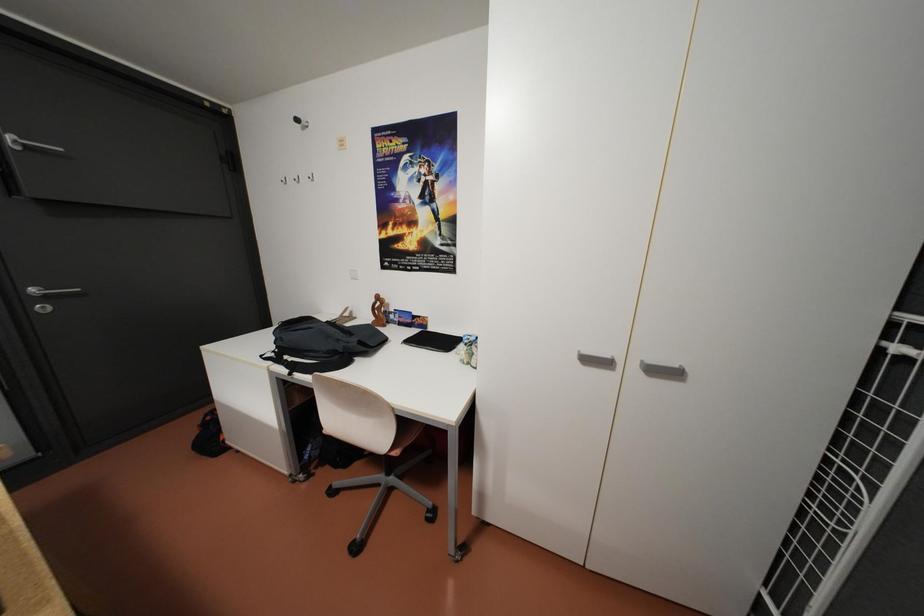
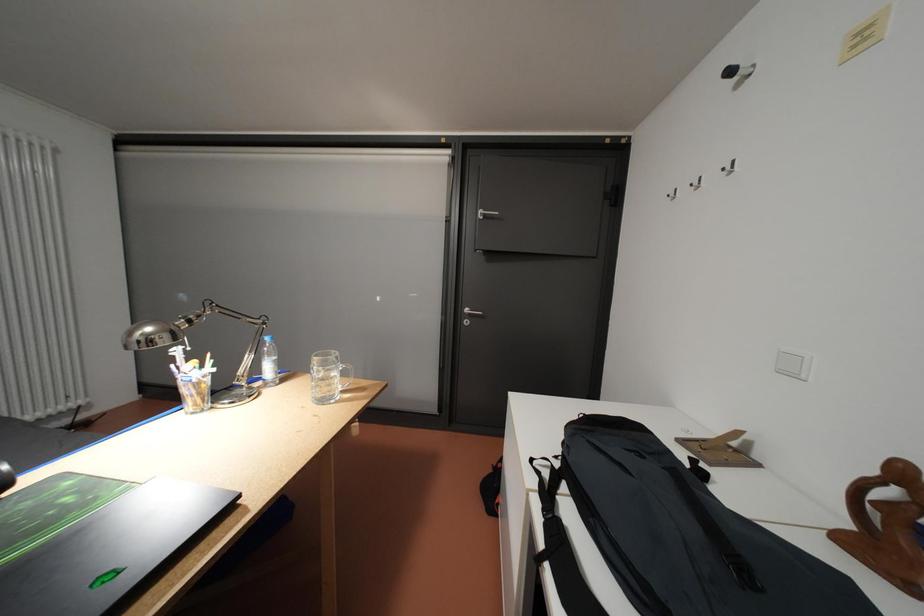
Question: The camera is either moving clockwise (left) or counter-clockwise (right) around the object. The first image is from the beginning of the video and the second image is from the end. Is the camera moving left or right when shooting the video?

Choices:
 (A) Left
 (B) Right

Answer: (B)